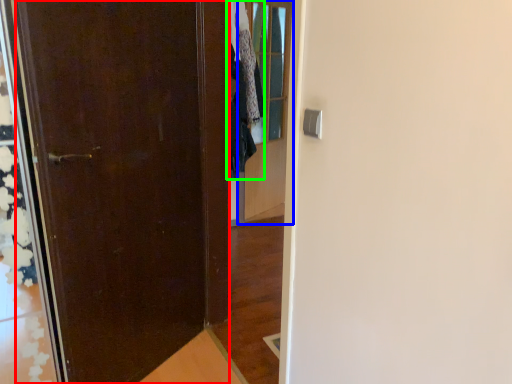
Question: Which is nearer to the door (highlighted by a red box)? glass door (highlighted by a blue box) or clothing (highlighted by a green box).

Choices:
 (A) glass door
 (B) clothing

Answer: (B)